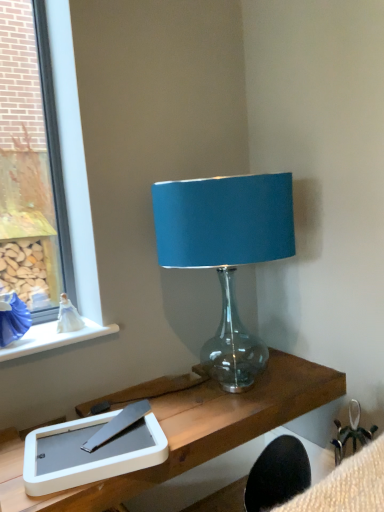
This screenshot has width=384, height=512. Identify the location of free spot above white ceramic window sill at upper left (from a real-world perspective). (44, 327).